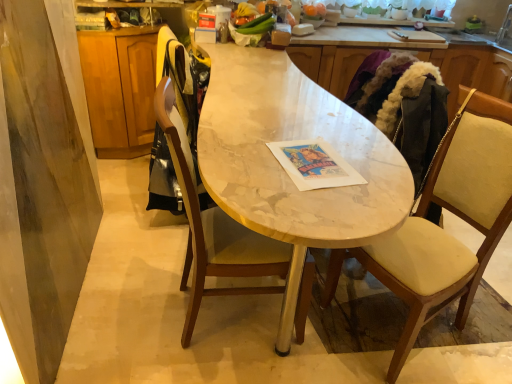
Question: Is wooden chair at center, arranged as the first chair when viewed from the left, bigger than white marble countertop at center?

Choices:
 (A) no
 (B) yes

Answer: (A)

Question: From a real-world perspective, is wooden chair at center, the 2th chair when ordered from right to left, beneath white marble countertop at center?

Choices:
 (A) yes
 (B) no

Answer: (A)

Question: Are wooden chair at center, the 2th chair when ordered from right to left, and white marble countertop at center far apart?

Choices:
 (A) no
 (B) yes

Answer: (A)

Question: From a real-world perspective, is wooden chair at center, the 2th chair when ordered from right to left, positioned over white marble countertop at center based on gravity?

Choices:
 (A) yes
 (B) no

Answer: (B)

Question: Can you confirm if wooden chair at center, the 2th chair when ordered from right to left, is shorter than white marble countertop at center?

Choices:
 (A) no
 (B) yes

Answer: (A)

Question: From a real-world perspective, relative to wooden cabinet at left, which is the second cabinetry from right to left, is silver metallic faucet at upper right vertically above or below?

Choices:
 (A) above
 (B) below

Answer: (A)

Question: In the image, is silver metallic faucet at upper right positioned in front of or behind wooden cabinet at left, which is the second cabinetry from right to left?

Choices:
 (A) front
 (B) behind

Answer: (B)

Question: Choose the correct answer: Is silver metallic faucet at upper right inside wooden cabinet at left, which is the second cabinetry from right to left, or outside it?

Choices:
 (A) inside
 (B) outside

Answer: (B)

Question: Based on their sizes in the image, would you say silver metallic faucet at upper right is bigger or smaller than wooden cabinet at left, marked as the first cabinetry in a left-to-right arrangement?

Choices:
 (A) small
 (B) big

Answer: (A)

Question: From a real-world perspective, relative to beige fabric chair at right, which is the 1th chair in right-to-left order, is light brown wood cabinet at upper right, acting as the first cabinetry starting from the right, vertically above or below?

Choices:
 (A) below
 (B) above

Answer: (B)

Question: Would you say light brown wood cabinet at upper right, acting as the first cabinetry starting from the right, is to the left or to the right of beige fabric chair at right, the second chair from the left, in the picture?

Choices:
 (A) right
 (B) left

Answer: (A)

Question: Considering their positions, is light brown wood cabinet at upper right, which is counted as the 2th cabinetry, starting from the left, located in front of or behind beige fabric chair at right, the second chair from the left?

Choices:
 (A) behind
 (B) front

Answer: (A)

Question: Based on their sizes in the image, would you say light brown wood cabinet at upper right, which is counted as the 2th cabinetry, starting from the left, is bigger or smaller than beige fabric chair at right, the second chair from the left?

Choices:
 (A) big
 (B) small

Answer: (B)

Question: Is point (438, 259) closer or farther from the camera than point (380, 185)?

Choices:
 (A) closer
 (B) farther

Answer: (B)

Question: Considering the positions of beige fabric chair at right, the second chair from the left, and white marble countertop at center in the image, is beige fabric chair at right, the second chair from the left, taller or shorter than white marble countertop at center?

Choices:
 (A) short
 (B) tall

Answer: (A)